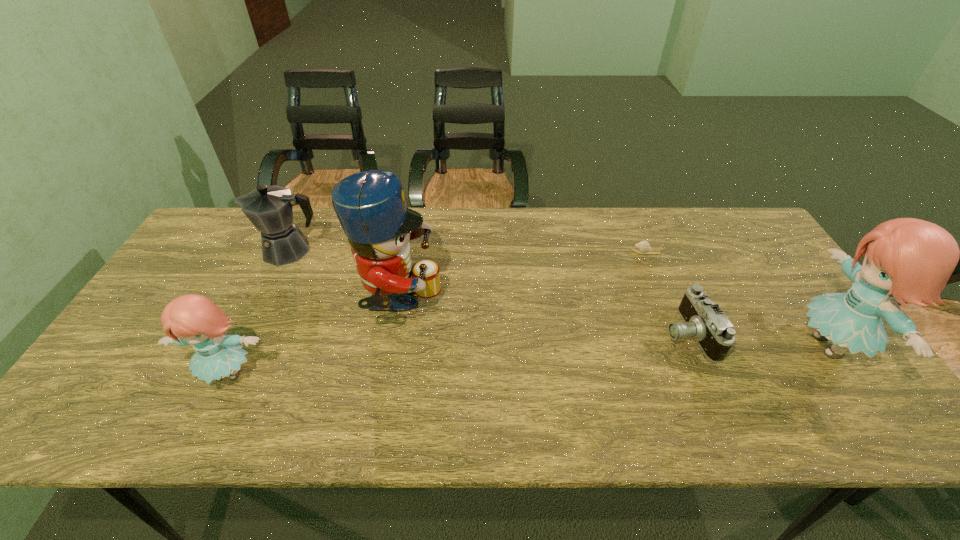
This screenshot has height=540, width=960. I want to click on vacant space that's between the third object from left to right and the coffeepot, so click(345, 277).

Where is `free area in between the shorter doll and the fifth tallest object`? This screenshot has height=540, width=960. free area in between the shorter doll and the fifth tallest object is located at coordinates tap(458, 354).

Where is `free space that is in between the left doll and the coffeepot`? This screenshot has width=960, height=540. free space that is in between the left doll and the coffeepot is located at coordinates (259, 312).

Identify the location of free space between the escargot and the fourth object from right to left. (523, 278).

Identify the location of vacant space that is in between the coffeepot and the camera. This screenshot has width=960, height=540. (489, 292).

Locate an element on the screen. The width and height of the screenshot is (960, 540). vacant area that lies between the escargot and the left doll is located at coordinates (438, 313).

Find the location of a particular element. This screenshot has height=540, width=960. free space between the taller doll and the coffeepot is located at coordinates (560, 298).

Locate an element on the screen. object that is the second closest to the nutcracker is located at coordinates (194, 320).

Identify which object is the second closest to the second shortest object. Please provide its 2D coordinates. Your answer should be formatted as a tuple, i.e. [(x, y)], where the tuple contains the x and y coordinates of a point satisfying the conditions above.

[(643, 247)]

Locate an element on the screen. vacant space that satisfies the following two spatial constraints: 1. on the shell of the shortest object; 2. on the front-facing side of the shorter doll is located at coordinates click(x=698, y=374).